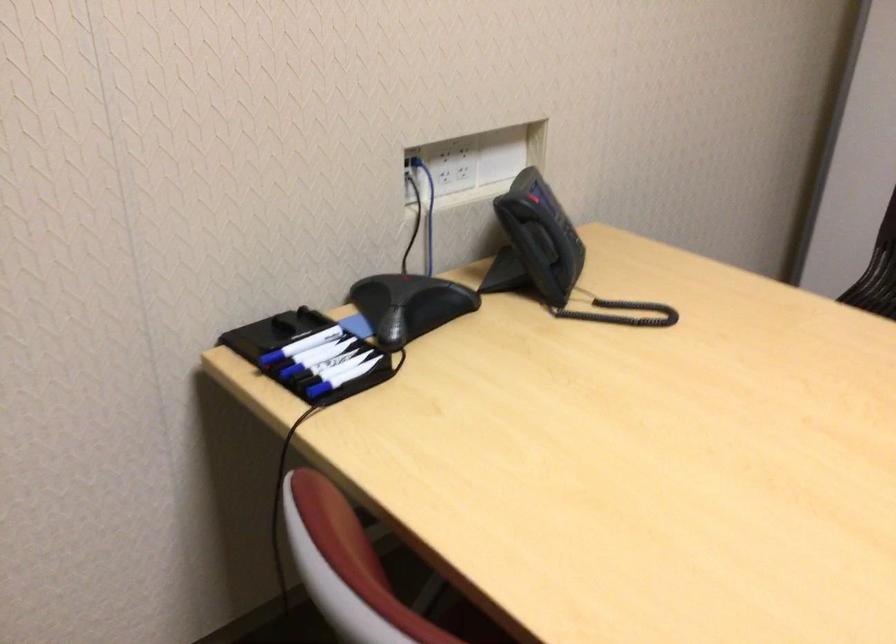
Where would you push the black network plug? Please return your answer as a coordinate pair (x, y).

(307, 379)